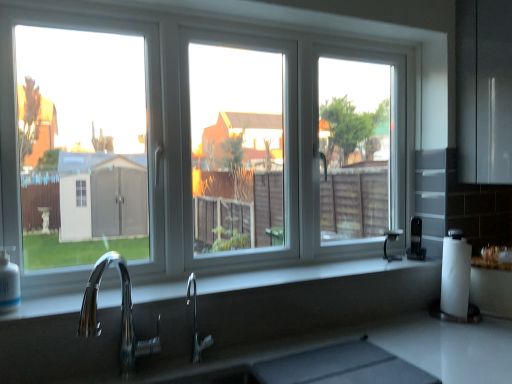
Find the location of a particular element. vacant space situated above smooth gray countertop at center (from a real-world perspective) is located at coordinates (226, 281).